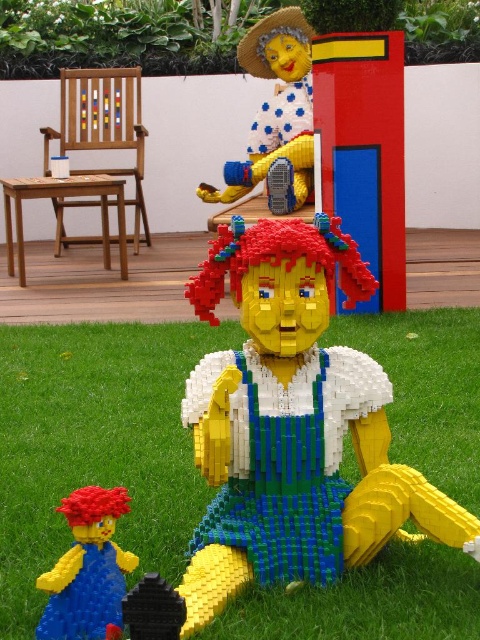
Question: Can you confirm if matte yellow plastic figure at upper center is positioned to the left of brick-patterned toy at lower left?

Choices:
 (A) yes
 (B) no

Answer: (B)

Question: Does green grass at lower center appear under brick-patterned toy at lower left?

Choices:
 (A) yes
 (B) no

Answer: (B)

Question: Which object appears farthest from the camera in this image?

Choices:
 (A) matte yellow plastic figure at upper center
 (B) green grass at lower center

Answer: (A)

Question: Observing the image, what is the correct spatial positioning of green grass at lower center in reference to matte yellow plastic figure at upper center?

Choices:
 (A) above
 (B) below

Answer: (B)

Question: Which point appears closest to the camera in this image?

Choices:
 (A) (448, 390)
 (B) (75, 637)

Answer: (B)

Question: Which of the following is the closest to the observer?

Choices:
 (A) green grass at lower center
 (B) matte yellow plastic figure at upper center

Answer: (A)